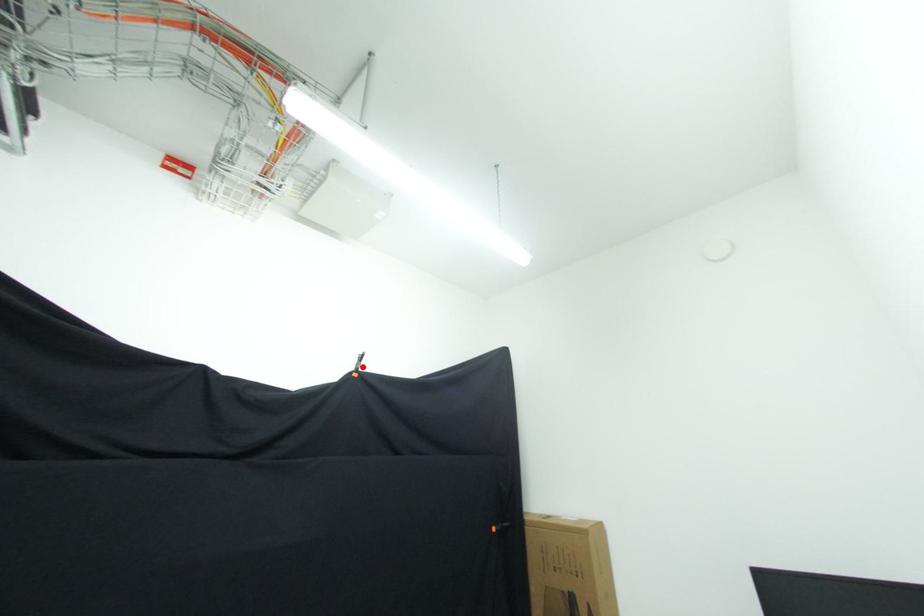
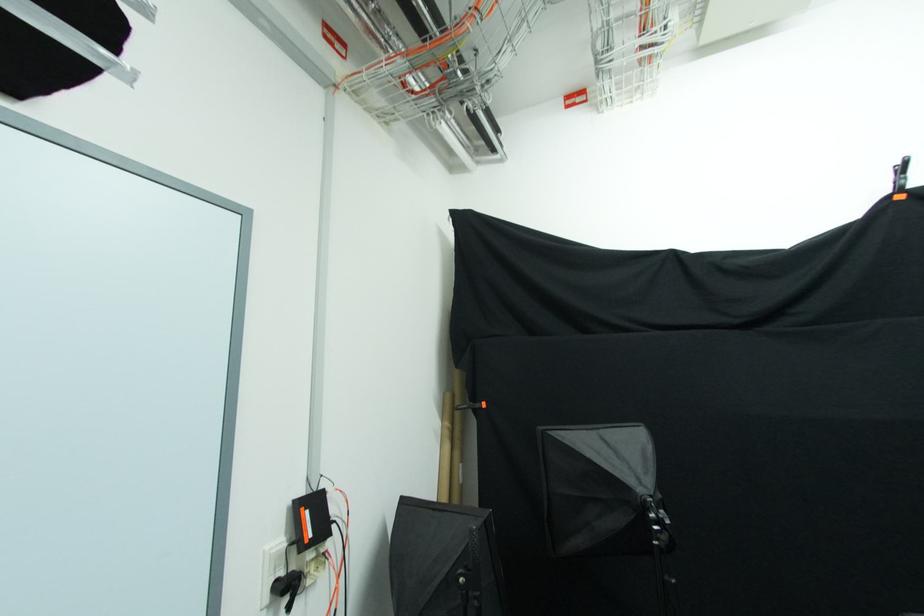
Locate, in the second image, the point that corresponds to the highlighted location in the first image.

(904, 180)